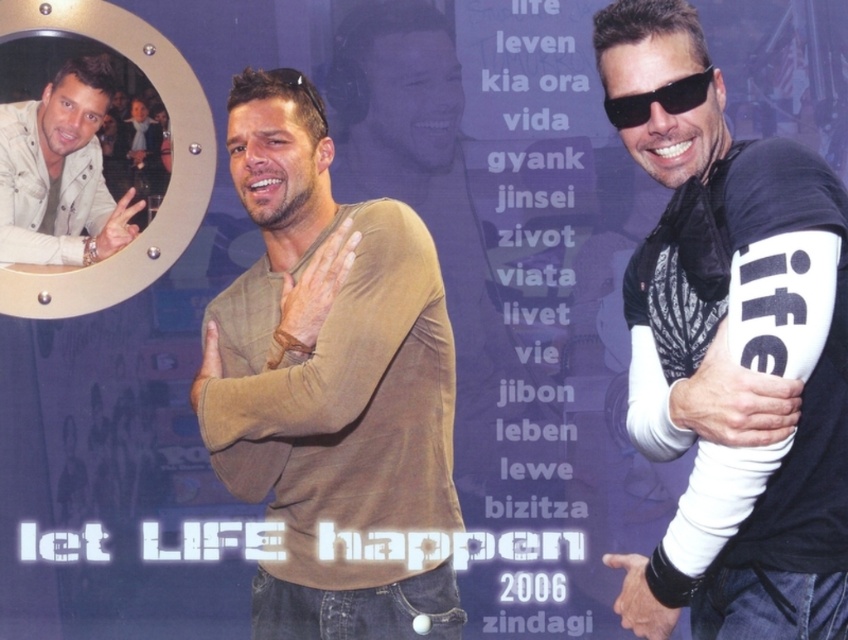
Question: Which object appears farthest from the camera in this image?

Choices:
 (A) black plastic goggles at center
 (B) light beige denim jacket at upper left
 (C) brown matte long-sleeve shirt at center

Answer: (B)

Question: Is black matte t-shirt at right wider than black matte sunglasses at center?

Choices:
 (A) no
 (B) yes

Answer: (B)

Question: Does light beige denim jacket at upper left appear over black plastic goggles at center?

Choices:
 (A) no
 (B) yes

Answer: (A)

Question: Which of the following is the closest to the observer?

Choices:
 (A) (433, 291)
 (B) (830, 364)

Answer: (B)

Question: Does brown matte long-sleeve shirt at center have a larger size compared to black matte sunglasses at center?

Choices:
 (A) no
 (B) yes

Answer: (B)

Question: Among these points, which one is nearest to the camera?

Choices:
 (A) (674, 81)
 (B) (326, 282)
 (C) (268, 72)

Answer: (A)